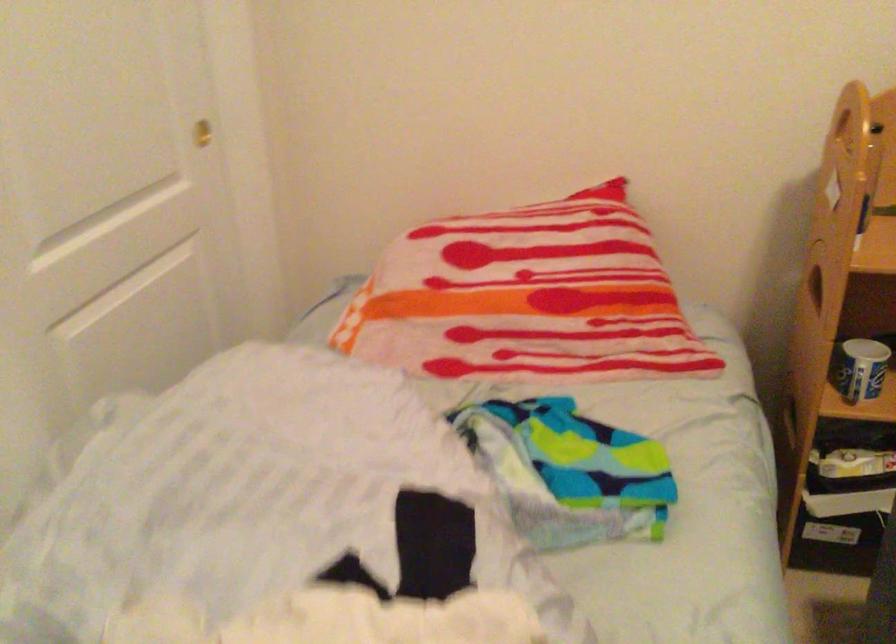
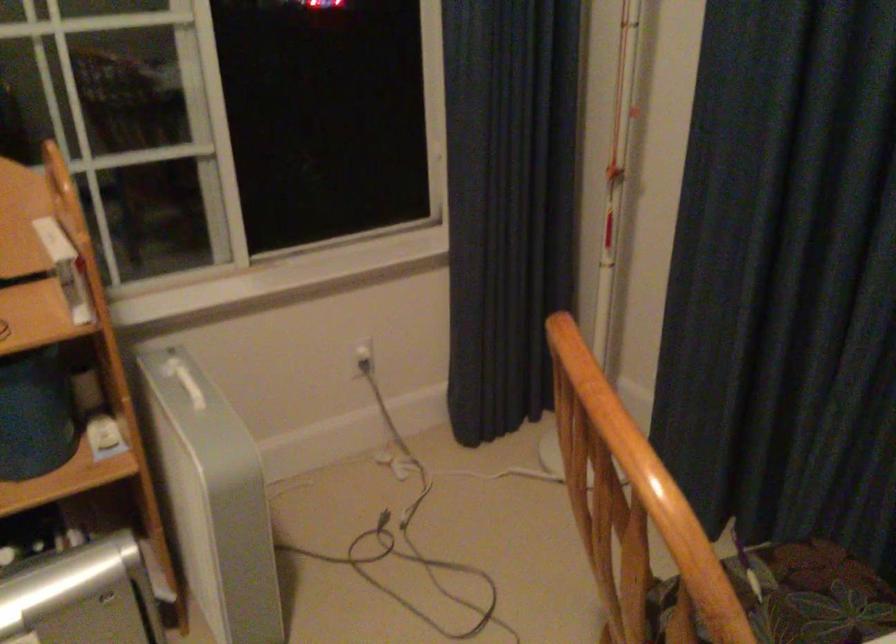
Question: Based on the continuous images, in which direction is the camera rotating? Reply with the corresponding letter.

Choices:
 (A) Left
 (B) Right
 (C) Up
 (D) Down

Answer: (B)